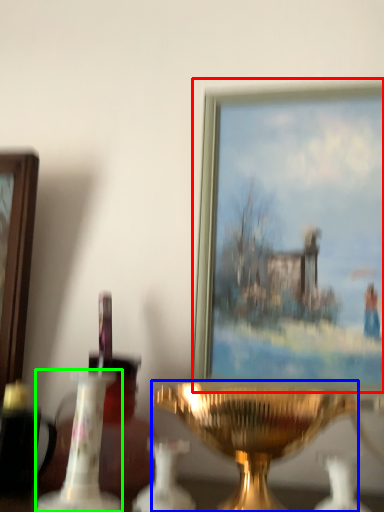
Question: Which object is positioned closest to picture frame (highlighted by a red box)? Select from candle holder (highlighted by a blue box) and candle holder (highlighted by a green box).

Choices:
 (A) candle holder
 (B) candle holder

Answer: (A)